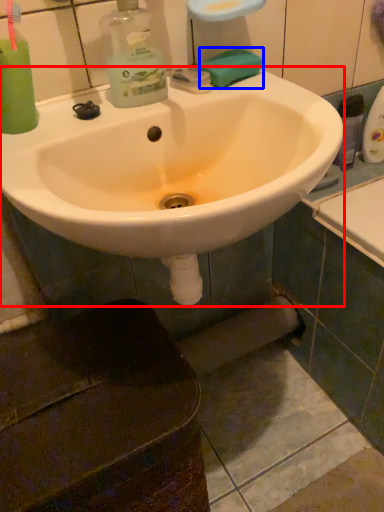
Question: Among these objects, which one is nearest to the camera, sink (highlighted by a red box) or soap (highlighted by a blue box)?

Choices:
 (A) sink
 (B) soap

Answer: (A)